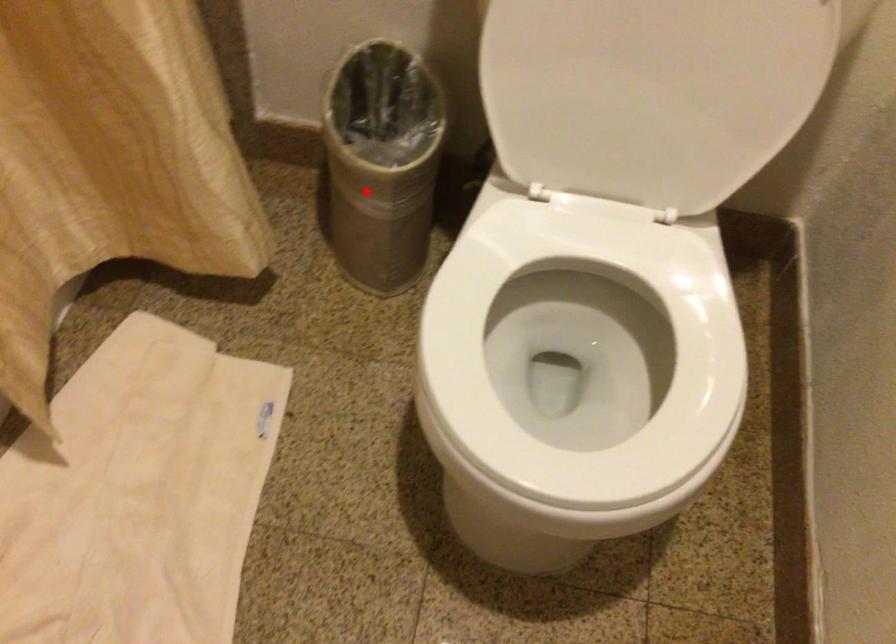
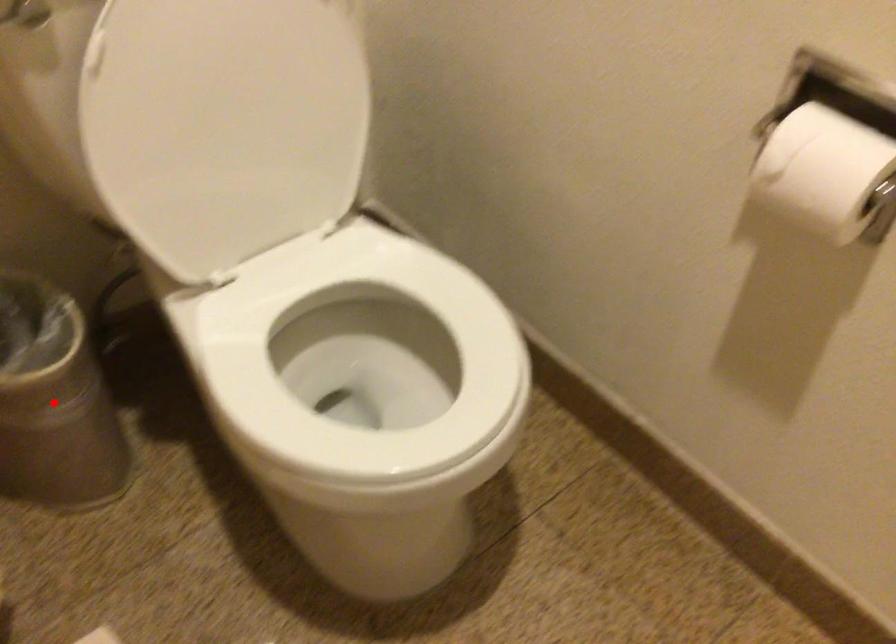
Based on the photo, I am providing you with two images of the same scene from different viewpoints. A red point is marked on the first image and another point is marked on the second image. Is the marked point in image1 the same physical position as the marked point in image2?

Yes